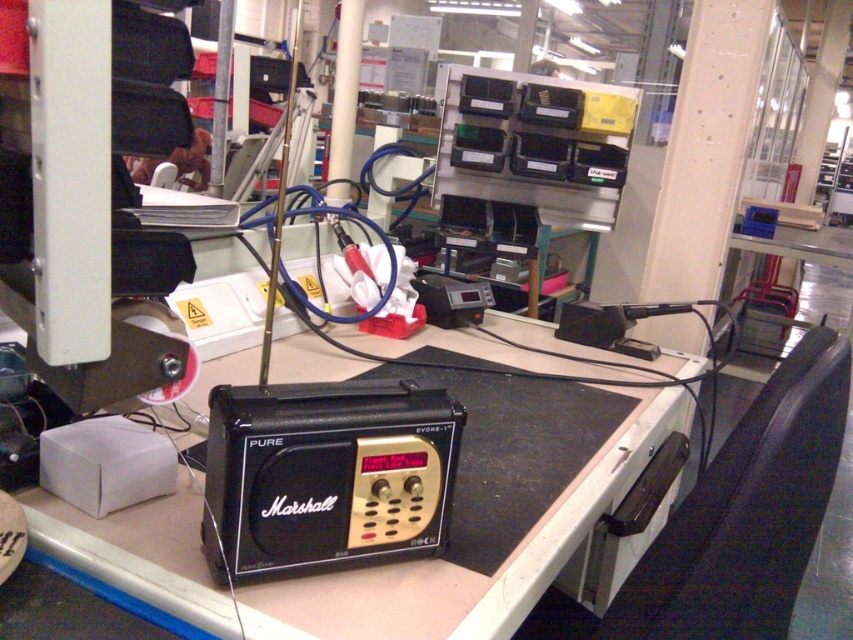
Who is higher up, black plastic table at center or black matte radio at center?

black matte radio at center is above.

Who is positioned more to the right, black plastic table at center or black matte radio at center?

black plastic table at center

Locate an element on the screen. The height and width of the screenshot is (640, 853). black plastic table at center is located at coordinates (465, 566).